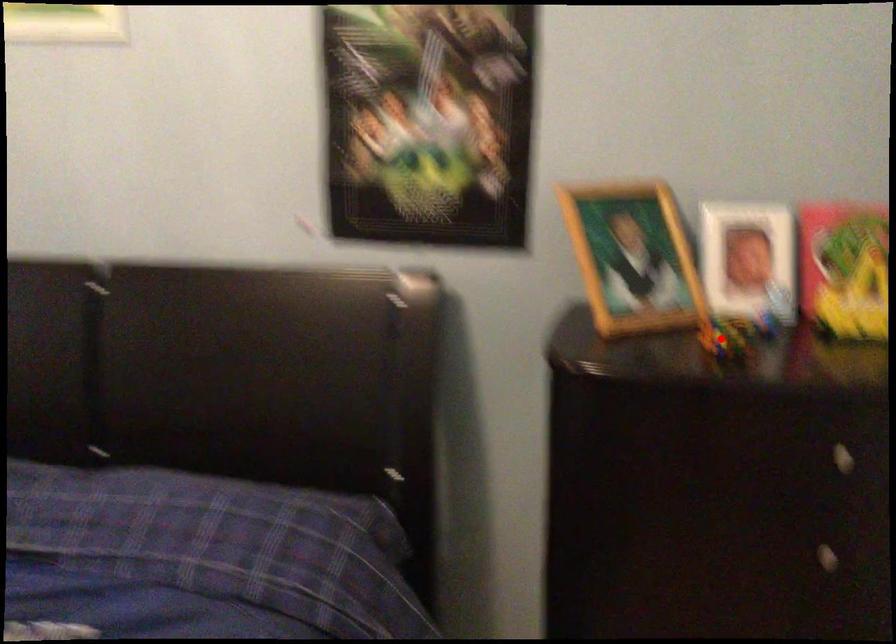
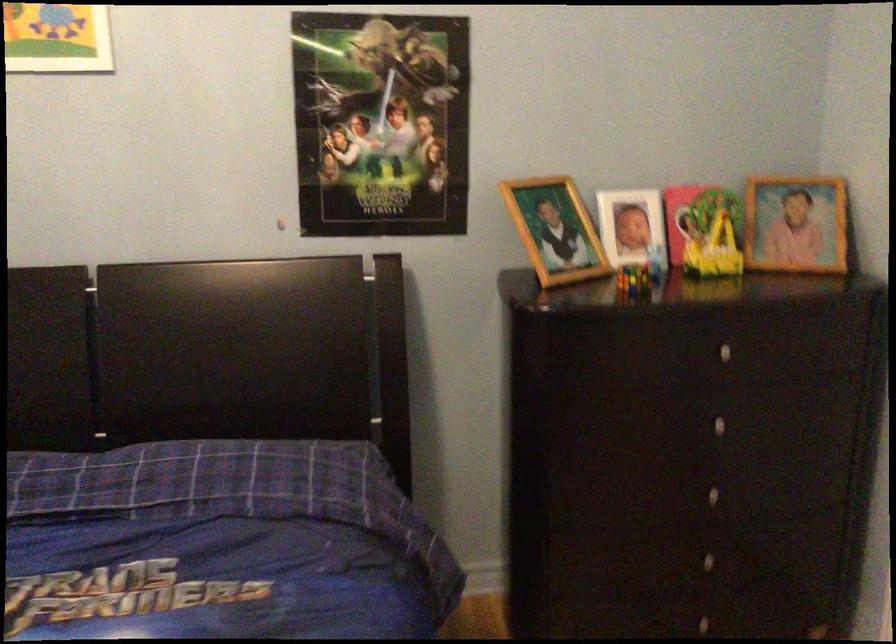
Question: I am providing you with two images of the same scene from different viewpoints. Image1 has a red point marked. In image2, the corresponding 3D location appears at what relative position? Reply with the corresponding letter.

Choices:
 (A) Closer
 (B) Farther

Answer: (B)